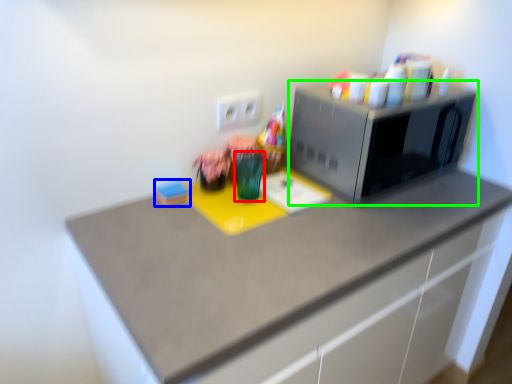
Question: Which object is positioned farthest from glass vase (highlighted by a red box)? Select from stationery (highlighted by a blue box) and microwave oven (highlighted by a green box).

Choices:
 (A) stationery
 (B) microwave oven

Answer: (B)